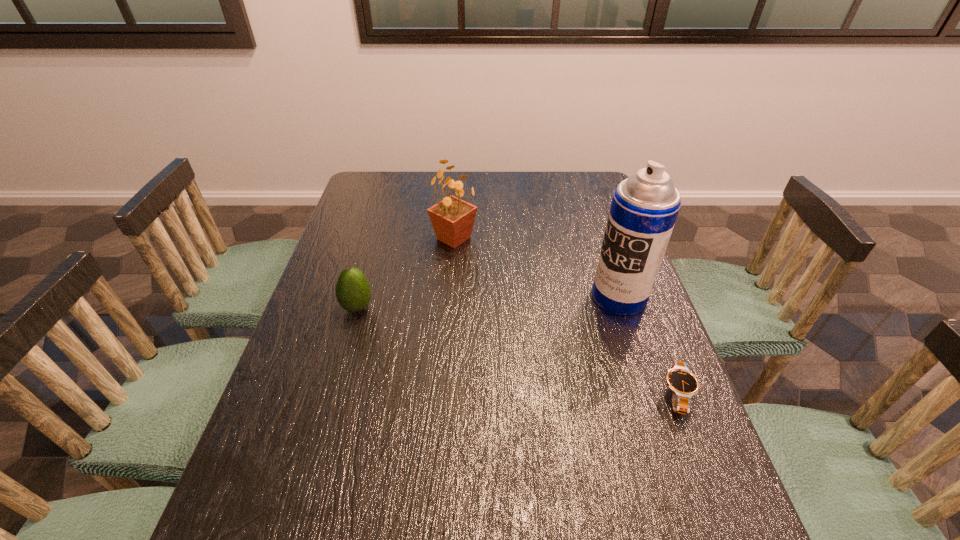
In the image, there is a desktop. Where is `vacant space at the right edge`? This screenshot has width=960, height=540. vacant space at the right edge is located at coordinates (642, 399).

At what (x,y) coordinates should I click in order to perform the action: click on free space at the far left corner of the desktop. Please return your answer as a coordinate pair (x, y). This screenshot has height=540, width=960. Looking at the image, I should click on (358, 188).

In the image, there is a desktop. At what (x,y) coordinates should I click in order to perform the action: click on vacant space at the far right corner. Please return your answer as a coordinate pair (x, y). This screenshot has height=540, width=960. Looking at the image, I should click on (605, 200).

You are a GUI agent. You are given a task and a screenshot of the screen. Output one action in this format:
    pyautogui.click(x=<x>, y=<y>)
    Task: Click on the vacant space in between the third object from right to left and the nearest object
    
    Given the screenshot: What is the action you would take?
    pyautogui.click(x=565, y=316)

This screenshot has width=960, height=540. I want to click on free space that is in between the avocado and the second tallest object, so click(405, 273).

You are a GUI agent. You are given a task and a screenshot of the screen. Output one action in this format:
    pyautogui.click(x=<x>, y=<y>)
    Task: Click on the vacant area that lies between the second object from left to right and the avocado
    This screenshot has width=960, height=540.
    Given the screenshot: What is the action you would take?
    pyautogui.click(x=405, y=273)

In order to click on free space between the avocado and the shortest object in this screenshot , I will do `click(517, 350)`.

Locate an element on the screen. The image size is (960, 540). free space between the third shortest object and the tallest object is located at coordinates tap(537, 268).

At what (x,y) coordinates should I click in order to perform the action: click on vacant region between the tallest object and the third object from right to left. Please return your answer as a coordinate pair (x, y). Looking at the image, I should click on (537, 268).

The image size is (960, 540). Identify the location of unoccupied position between the tallest object and the watch. (648, 346).